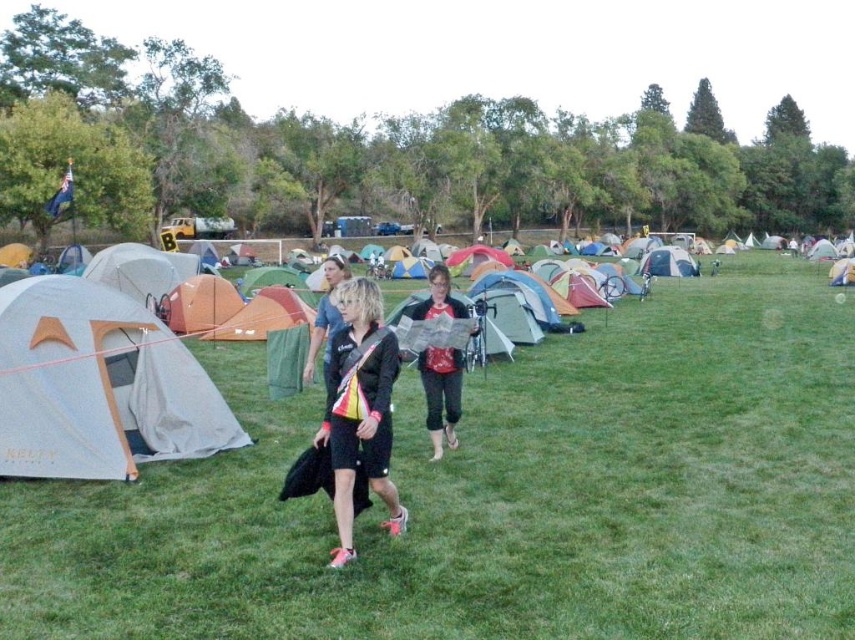
Question: Can you confirm if gray fabric tent at left is bigger than black matte jacket at center?

Choices:
 (A) no
 (B) yes

Answer: (B)

Question: Is green grass at center above gray fabric tent at left?

Choices:
 (A) yes
 (B) no

Answer: (A)

Question: Observing the image, what is the correct spatial positioning of gray fabric tent at left in reference to black matte jacket at center?

Choices:
 (A) left
 (B) right

Answer: (A)

Question: Which object is positioned closest to the black fabric jacket at center?

Choices:
 (A) black matte jacket at center
 (B) green grass at center
 (C) gray fabric tent at left
 (D) red fabric map at center

Answer: (A)

Question: Estimate the real-world distances between objects in this image. Which object is farther from the red fabric map at center?

Choices:
 (A) black fabric jacket at center
 (B) black matte jacket at center
 (C) green grass at center

Answer: (C)

Question: Estimate the real-world distances between objects in this image. Which object is closer to the black matte jacket at center?

Choices:
 (A) black fabric jacket at center
 (B) green grass at center
 (C) red fabric map at center
 (D) gray fabric tent at left

Answer: (A)